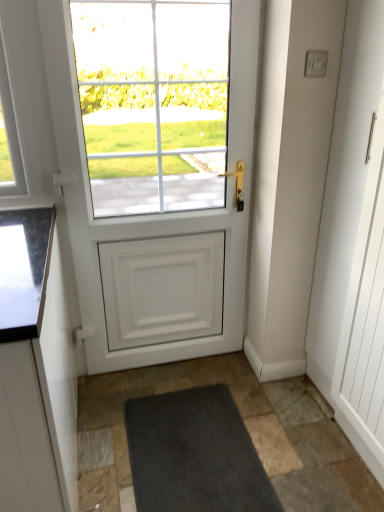
You are a GUI agent. You are given a task and a screenshot of the screen. Output one action in this format:
    pyautogui.click(x=<x>, y=<y>)
    Task: Click on the white matte door at center
    This screenshot has height=512, width=384.
    Given the screenshot: What is the action you would take?
    pyautogui.click(x=155, y=170)

Measure the distance between point [92,236] and camera.

A distance of 6.04 feet exists between point [92,236] and camera.

Image resolution: width=384 pixels, height=512 pixels. Describe the element at coordinates (155, 170) in the screenshot. I see `white matte door at center` at that location.

I want to click on white matte door at center, so click(x=155, y=170).